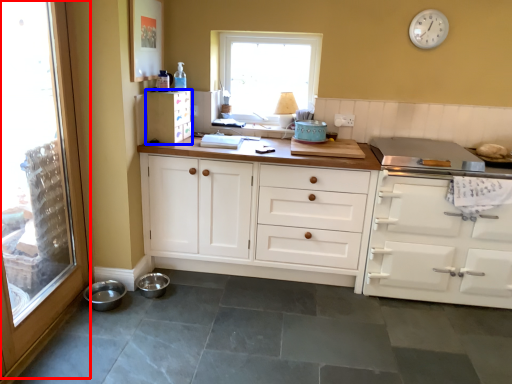
Question: Which point is further to the camera, glass door (highlighted by a red box) or cabinetry (highlighted by a blue box)?

Choices:
 (A) glass door
 (B) cabinetry

Answer: (B)